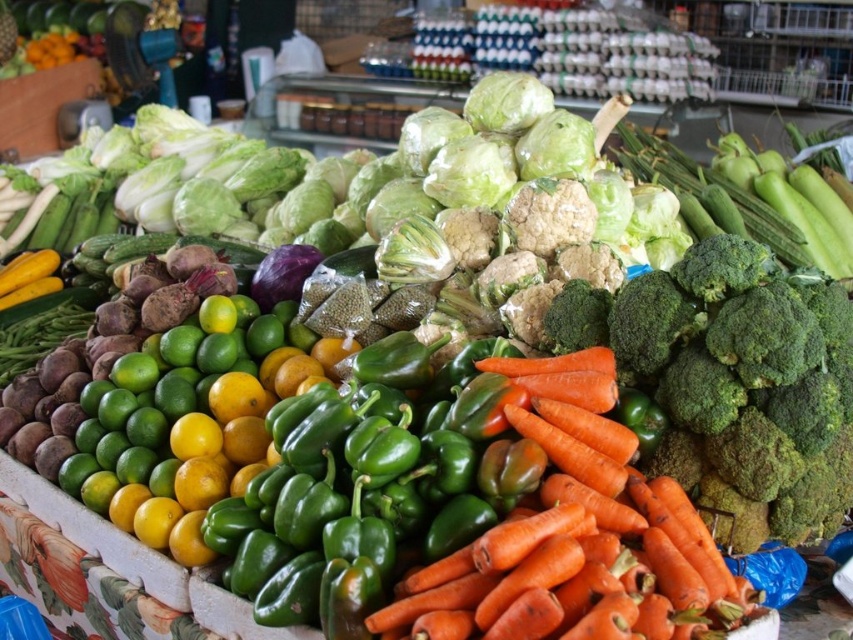
Is green matte broccoli at right thinner than green broccoli at center?

No, green matte broccoli at right is not thinner than green broccoli at center.

Which is in front, point (767, 486) or point (589, 342)?

Point (767, 486) is in front.

You are a GUI agent. You are given a task and a screenshot of the screen. Output one action in this format:
    pyautogui.click(x=<x>, y=<y>)
    Task: Click on the green matte broccoli at right
    The width and height of the screenshot is (853, 640).
    Given the screenshot: What is the action you would take?
    pyautogui.click(x=746, y=380)

Is orange rough carrots at center to the left of green matte broccoli at right from the viewer's perspective?

Yes, orange rough carrots at center is to the left of green matte broccoli at right.

Image resolution: width=853 pixels, height=640 pixels. In order to click on orange rough carrots at center in this screenshot , I will do `click(573, 532)`.

Locate an element on the screen. The image size is (853, 640). orange rough carrots at center is located at coordinates (573, 532).

Who is more forward, [399,632] or [585,310]?

Point [399,632]

Can you confirm if orange rough carrots at center is positioned below green broccoli at center?

Yes, orange rough carrots at center is below green broccoli at center.

Is point (506, 358) farther from viewer compared to point (567, 352)?

No.

Find the location of a particular element. This screenshot has width=853, height=640. orange rough carrots at center is located at coordinates (573, 532).